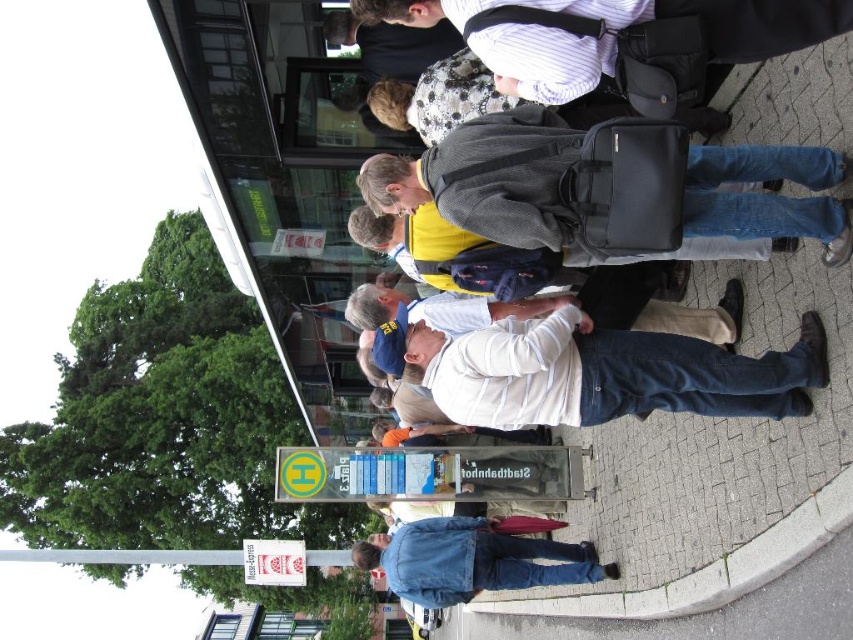
Which is below, dark gray backpack at center or denim jacket at lower right?

Positioned lower is denim jacket at lower right.

Where is `dark gray backpack at center`? dark gray backpack at center is located at coordinates (496, 182).

This screenshot has height=640, width=853. I want to click on dark gray backpack at center, so click(496, 182).